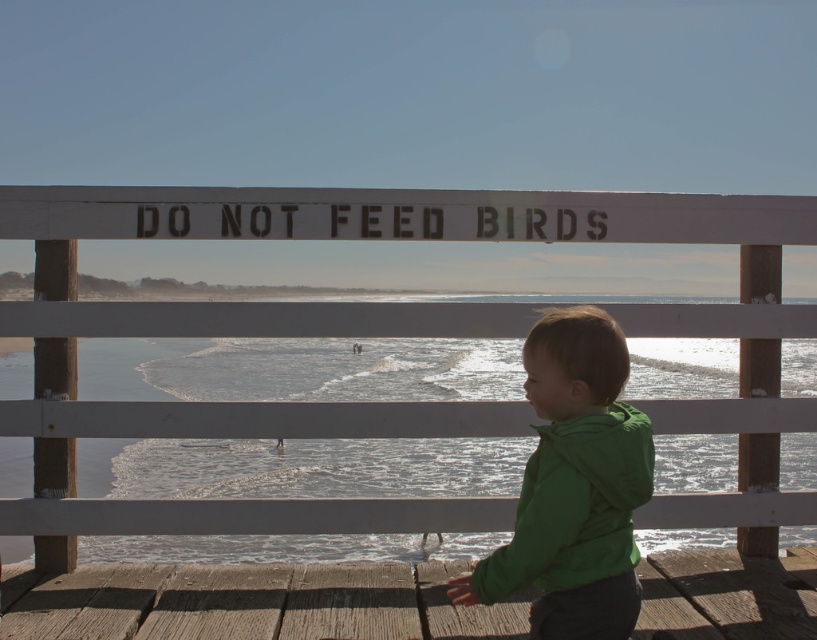
A child wearing a green matte jacket at lower right wants to throw a pebble into the clear water at lower center. Based on the distance between them, is it possible for the child to reach the water without stepping off the pier?

The green matte jacket at lower right is 8.32 feet away from the clear water at lower center. Since the child is already on the pier, they can easily throw the pebble 8.32 feet to reach the clear water at lower center without needing to step off the pier.

You are a photographer trying to capture a wide shot of the wooden dock at lower center and the green matte jacket at lower right. Given that your camera can only focus on objects within a 3 meter width, will both objects fit within the frame?

The wooden dock at lower center is wider than the green matte jacket at lower right. Since the dock is wider, but the total combined width of both objects would depend on their actual sizes. However, the camera can focus on objects within a 3 meter width. Without exact measurements, it is uncertain if both will fit. Please check the actual dimensions.